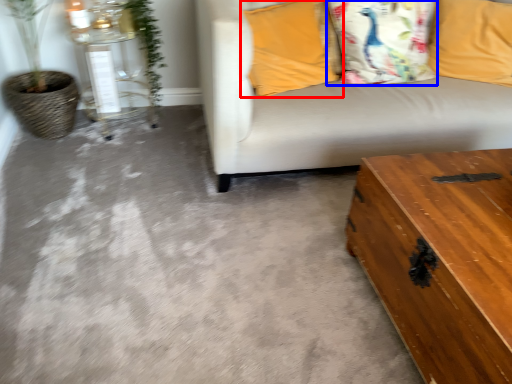
Question: Which of the following is the closest to the observer, pillow (highlighted by a red box) or pillow (highlighted by a blue box)?

Choices:
 (A) pillow
 (B) pillow

Answer: (A)